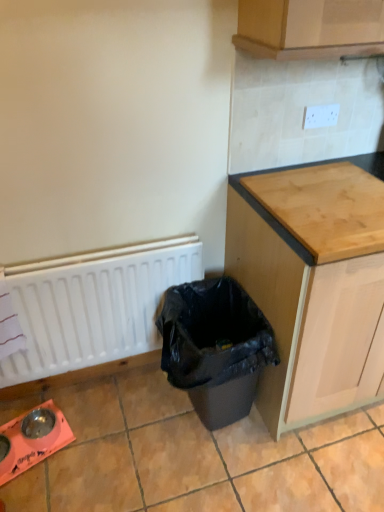
Find the location of a particular element. The width and height of the screenshot is (384, 512). free space in front of black plastic waste bin at lower center is located at coordinates (210, 482).